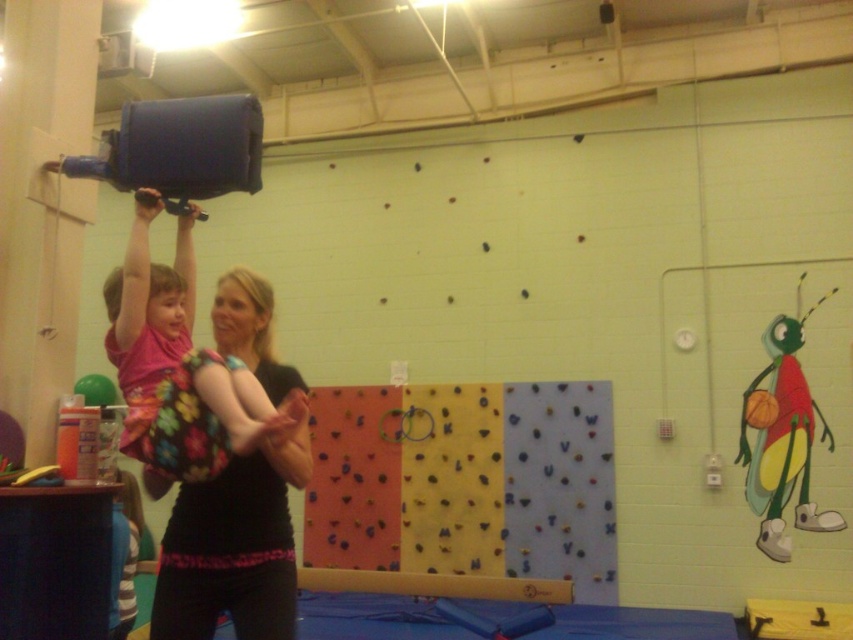
In the scene shown: You are standing in the gymnasium and see both the black fabric shirt at center and the floral fabric dress at center. Which one is closer to you?

The black fabric shirt at center is closer to you because it is further to the viewer than the floral fabric dress at center.

You are a photographer setting up for a family photoshoot in this gymnasium. You need to position a lighting fixture so it illuminates both the black fabric shirt at center and the pink fabric head at upper center equally. Considering their positions, which object should the light be angled towards first to ensure both are well lit?

The black fabric shirt at center is much taller than the pink fabric head at upper center. To ensure both are equally illuminated, the light should first be angled towards the taller black fabric shirt at center, then adjusted to cover the lower pink fabric head at upper center.

You are a parent trying to guide your child through an obstacle course in the gym. The course requires the child to first step onto the yellow foam beam at center and then crawl under the cartoonish fabric bug at right. Based on their positions, is this sequence possible?

The yellow foam beam at center is behind the cartoonish fabric bug at right, so the child would need to first crawl under the cartoonish fabric bug at right and then step onto the yellow foam beam at center. The required sequence is not possible as the beam is positioned behind the bug.